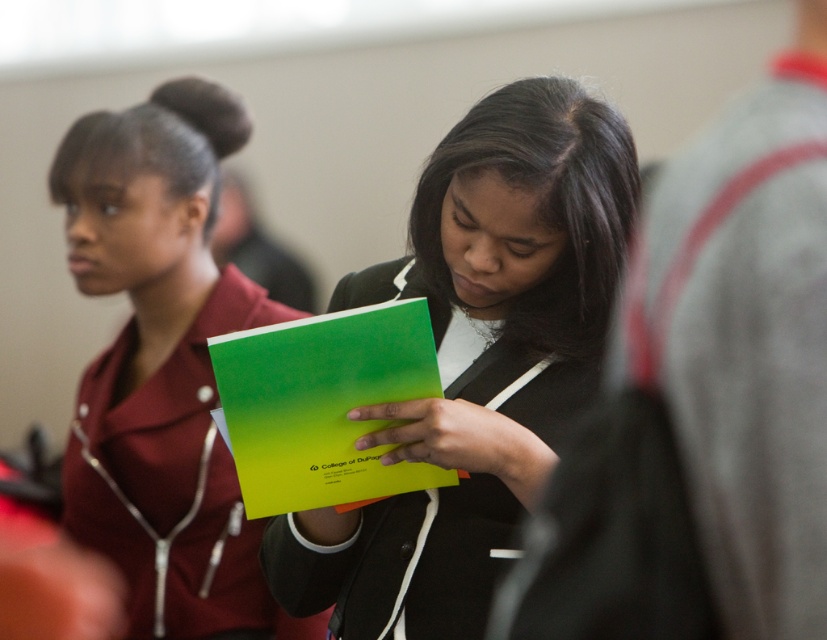
Can you confirm if matte green folder at center is shorter than maroon fabric shirt at upper left?

Correct, matte green folder at center is not as tall as maroon fabric shirt at upper left.

Which is more to the right, matte green folder at center or maroon fabric shirt at upper left?

From the viewer's perspective, matte green folder at center appears more on the right side.

Where is `matte green folder at center`? This screenshot has width=827, height=640. matte green folder at center is located at coordinates (476, 360).

What do you see at coordinates (161, 365) in the screenshot? I see `maroon fabric shirt at upper left` at bounding box center [161, 365].

Can you confirm if maroon fabric shirt at upper left is wider than green matte folder at center?

Yes, maroon fabric shirt at upper left is wider than green matte folder at center.

Between point (300, 625) and point (271, 385), which one is positioned behind?

The point (300, 625) is more distant.

I want to click on maroon fabric shirt at upper left, so click(x=161, y=365).

Who is more distant from viewer, [620,250] or [242,496]?

Point [620,250]

Does matte green folder at center have a lesser height compared to green matte folder at center?

No.

Image resolution: width=827 pixels, height=640 pixels. Describe the element at coordinates (476, 360) in the screenshot. I see `matte green folder at center` at that location.

Find the location of a particular element. matte green folder at center is located at coordinates (476, 360).